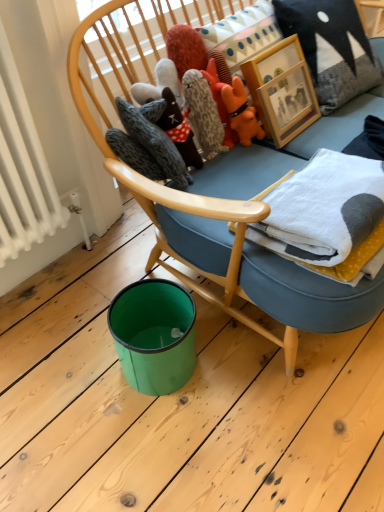
Question: Which direction should I rotate to look at fluffy gray stuffed animal at upper center, which appears as the second toy when viewed from the right?

Choices:
 (A) right
 (B) left

Answer: (B)

Question: Can you confirm if white fleece blanket at upper right is thinner than fluffy gray stuffed animal at upper center, which appears as the second toy when viewed from the right?

Choices:
 (A) no
 (B) yes

Answer: (A)

Question: Is white fleece blanket at upper right wider than fluffy gray stuffed animal at upper center, which appears as the second toy when viewed from the right?

Choices:
 (A) no
 (B) yes

Answer: (B)

Question: From the image's perspective, is white fleece blanket at upper right on fluffy gray stuffed animal at upper center, which appears as the second toy when viewed from the right?

Choices:
 (A) yes
 (B) no

Answer: (B)

Question: Is white fleece blanket at upper right at the left side of fluffy gray stuffed animal at upper center, which appears as the second toy when viewed from the right?

Choices:
 (A) yes
 (B) no

Answer: (B)

Question: Is white fleece blanket at upper right closer to camera compared to fluffy gray stuffed animal at upper center, which appears as the second toy when viewed from the right?

Choices:
 (A) no
 (B) yes

Answer: (B)

Question: Can you confirm if white fleece blanket at upper right is taller than fluffy gray stuffed animal at upper center, which appears as the second toy when viewed from the right?

Choices:
 (A) yes
 (B) no

Answer: (B)

Question: Would you say white fleece blanket at upper right is a long distance from textured gray pillow at upper right?

Choices:
 (A) yes
 (B) no

Answer: (B)

Question: Is white fleece blanket at upper right to the right of textured gray pillow at upper right from the viewer's perspective?

Choices:
 (A) no
 (B) yes

Answer: (A)

Question: Is textured gray pillow at upper right surrounded by white fleece blanket at upper right?

Choices:
 (A) no
 (B) yes

Answer: (A)

Question: Is white fleece blanket at upper right located outside textured gray pillow at upper right?

Choices:
 (A) no
 (B) yes

Answer: (B)

Question: From the image's perspective, would you say white fleece blanket at upper right is shown under textured gray pillow at upper right?

Choices:
 (A) yes
 (B) no

Answer: (A)

Question: Does white fleece blanket at upper right appear on the left side of textured gray pillow at upper right?

Choices:
 (A) no
 (B) yes

Answer: (B)

Question: Is white fleece blanket at upper right at the back of wooden picture frame at upper center?

Choices:
 (A) yes
 (B) no

Answer: (B)